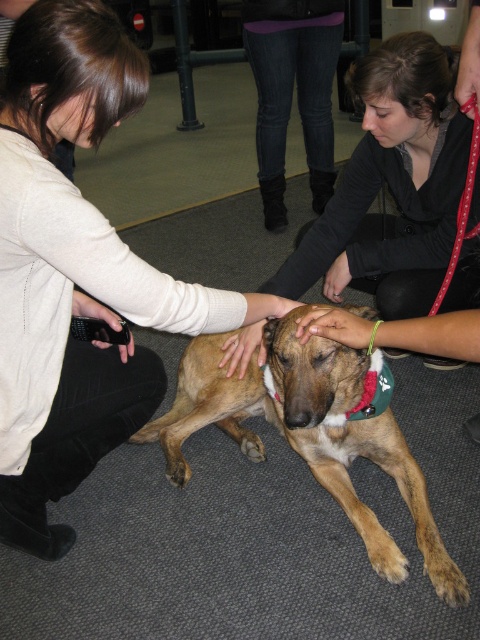
You are a tailor who needs to determine which item is larger in size between the matte beige sweater at center and the brown furry dog at center. Based on the scene description, which one is bigger?

The matte beige sweater at center is bigger than the brown furry dog at center according to the description.

You are a photographer trying to capture a closeup of the matte black shirt at center and the brown furry dog at center in the scene. Given that your camera can only focus on objects within 18 inches of each other, will you be able to take the photo?

The matte black shirt at center and brown furry dog at center are 19.82 inches apart, which is slightly more than the 18 inches required for the camera to focus. Therefore, the photo may not be in focus.

You are a photographer trying to capture a closeup of the matte beige sweater at center without the brown furry dog at center blocking the view. Based on their positions, is this possible?

The matte beige sweater at center is in front of the brown furry dog at center, so the sweater is blocking the view of the dog. Therefore, you cannot capture a clear closeup of the sweater without the dog being behind it.